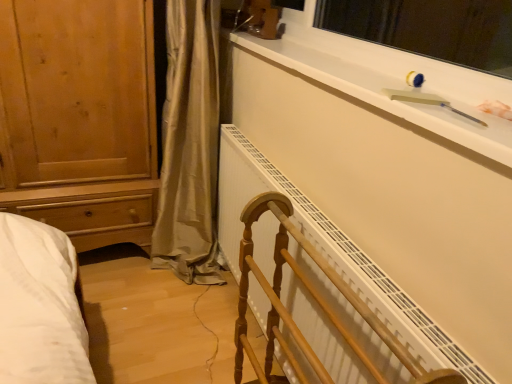
In order to click on wooden towel rack at center in this screenshot , I will do `click(316, 302)`.

This screenshot has height=384, width=512. Identify the location of white plastic window screen at upper right. click(x=429, y=28).

Is white matte window sill at upper right far away from white plastic window screen at upper right?

white matte window sill at upper right is actually quite close to white plastic window screen at upper right.

Is white matte window sill at upper right not within white plastic window screen at upper right?

white matte window sill at upper right is positioned outside white plastic window screen at upper right.

Considering the sizes of objects white matte window sill at upper right and white plastic window screen at upper right in the image provided, who is shorter, white matte window sill at upper right or white plastic window screen at upper right?

With less height is white matte window sill at upper right.

Is point (456, 79) farther from camera compared to point (329, 18)?

No, (456, 79) is closer to viewer.

From the image's perspective, is white plastic window screen at upper right located above wooden towel rack at center?

Yes.

How much distance is there between white plastic window screen at upper right and wooden towel rack at center?

They are 4.24 feet apart.

Does white plastic window screen at upper right contain wooden towel rack at center?

Actually, wooden towel rack at center is outside white plastic window screen at upper right.

From a real-world perspective, is white plastic window screen at upper right over wooden towel rack at center?

Yes, from a real-world perspective, white plastic window screen at upper right is over wooden towel rack at center

Find the location of `furniture that appears below the white plastic window screen at upper right (from a real-world perspective)`. furniture that appears below the white plastic window screen at upper right (from a real-world perspective) is located at coordinates (316, 302).

Can you confirm if wooden towel rack at center is bigger than white plastic window screen at upper right?

Indeed, wooden towel rack at center has a larger size compared to white plastic window screen at upper right.

Is white plastic window screen at upper right located within wooden towel rack at center?

No.

Measure the distance between wooden towel rack at center and white matte window sill at upper right.

The distance of wooden towel rack at center from white matte window sill at upper right is 20.91 inches.

Which point is more distant from viewer, (249,225) or (399,68)?

The point (399,68) is behind.

Can you confirm if wooden towel rack at center is thinner than white matte window sill at upper right?

No, wooden towel rack at center is not thinner than white matte window sill at upper right.

From a real-world perspective, relative to white matte window sill at upper right, is wooden towel rack at center vertically above or below?

In terms of real-world spatial position, wooden towel rack at center is below white matte window sill at upper right.

Is white matte window sill at upper right in front of wooden towel rack at center?

No.

Does white matte window sill at upper right turn towards wooden towel rack at center?

No.

Consider the image. From the image's perspective, is white matte window sill at upper right positioned above or below wooden towel rack at center?

Based on their image positions, white matte window sill at upper right is located above wooden towel rack at center.

Is white matte window sill at upper right located outside wooden towel rack at center?

Yes, white matte window sill at upper right is located beyond the bounds of wooden towel rack at center.

Considering the points (459, 3) and (300, 24), which point is in front, point (459, 3) or point (300, 24)?

The point (300, 24) is in front.

In the image, is white plastic window screen at upper right positioned in front of or behind white matte window sill at upper right?

In the image, white plastic window screen at upper right appears behind white matte window sill at upper right.

Can white matte window sill at upper right be found inside white plastic window screen at upper right?

Answer: That's incorrect, white matte window sill at upper right is not inside white plastic window screen at upper right.

The height and width of the screenshot is (384, 512). I want to click on window screen behind the white matte window sill at upper right, so click(429, 28).

This screenshot has height=384, width=512. In order to click on window screen above the wooden towel rack at center (from the image's perspective) in this screenshot , I will do click(429, 28).

Looking at this image, estimate the real-world distances between objects in this image. Which object is further from white matte window sill at upper right, white plastic window screen at upper right or wooden towel rack at center?

white plastic window screen at upper right.

Looking at the image, which one is located further to wooden towel rack at center, white plastic window screen at upper right or white matte window sill at upper right?

The object further to wooden towel rack at center is white plastic window screen at upper right.

Looking at the image, which one is located closer to wooden towel rack at center, white matte window sill at upper right or white plastic window screen at upper right?

white matte window sill at upper right.

From the image, which object appears to be nearer to white plastic window screen at upper right, wooden towel rack at center or white matte window sill at upper right?

white matte window sill at upper right is closer to white plastic window screen at upper right.

Looking at the image, which one is located further to white plastic window screen at upper right, white matte window sill at upper right or wooden towel rack at center?

The object further to white plastic window screen at upper right is wooden towel rack at center.

Looking at the image, which one is located further to white matte window sill at upper right, wooden towel rack at center or white plastic window screen at upper right?

Among the two, white plastic window screen at upper right is located further to white matte window sill at upper right.

Where is `window sill between white plastic window screen at upper right and wooden towel rack at center from top to bottom`? The height and width of the screenshot is (384, 512). window sill between white plastic window screen at upper right and wooden towel rack at center from top to bottom is located at coordinates (395, 83).